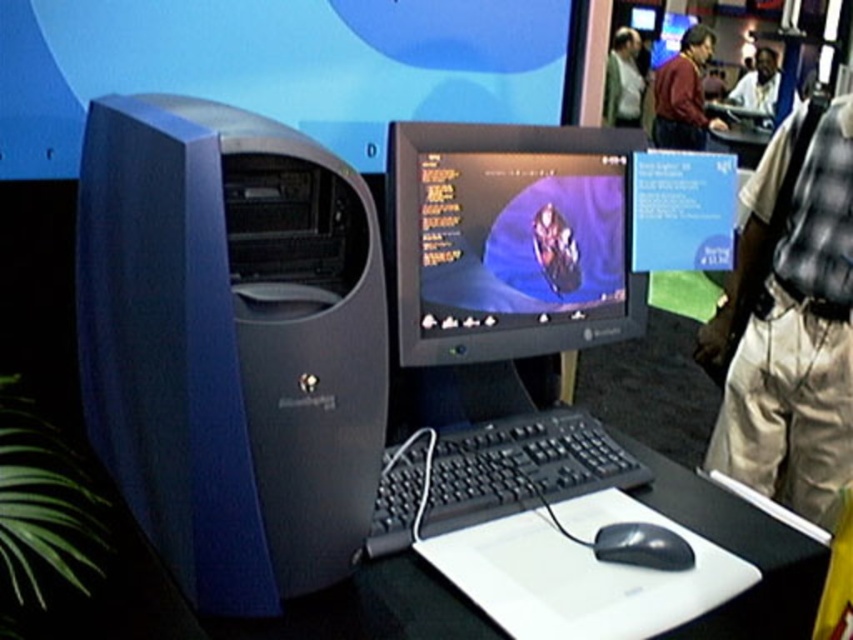
Describe the element at coordinates (683, 93) in the screenshot. This screenshot has height=640, width=853. I see `maroon sweater at center` at that location.

Which is above, maroon sweater at center or black leather jacket at upper right?

Positioned higher is black leather jacket at upper right.

You are a GUI agent. You are given a task and a screenshot of the screen. Output one action in this format:
    pyautogui.click(x=<x>, y=<y>)
    Task: Click on the maroon sweater at center
    The width and height of the screenshot is (853, 640).
    Given the screenshot: What is the action you would take?
    pyautogui.click(x=683, y=93)

Locate an element on the screen. maroon sweater at center is located at coordinates (683, 93).

Can you confirm if matte black monitor at center is shorter than light gray shirt at upper center?

Indeed, matte black monitor at center has a lesser height compared to light gray shirt at upper center.

Can you confirm if matte black monitor at center is taller than light gray shirt at upper center?

In fact, matte black monitor at center may be shorter than light gray shirt at upper center.

Which is behind, point (486, 337) or point (630, 124)?

The point (630, 124) is more distant.

Locate an element on the screen. Image resolution: width=853 pixels, height=640 pixels. matte black monitor at center is located at coordinates (509, 241).

Which is above, blue plastic desktop computer at left or black glossy mouse at lower center?

blue plastic desktop computer at left is above.

Is blue plastic desktop computer at left shorter than black glossy mouse at lower center?

No.

Does point (88, 385) lie behind point (635, 538)?

Yes, it is.

What are the coordinates of `blue plastic desktop computer at left` in the screenshot? It's located at (231, 342).